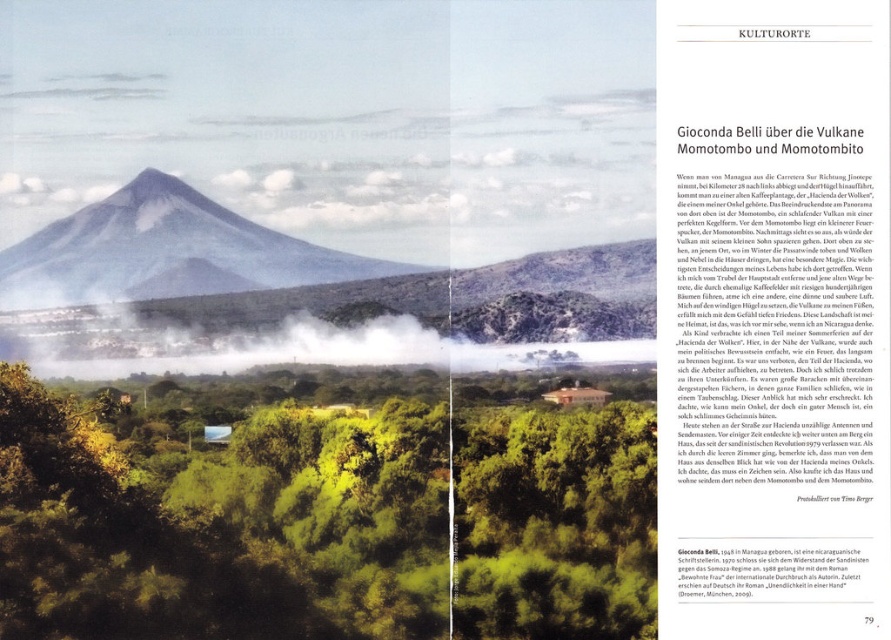
Question: Which object appears farthest from the camera in this image?

Choices:
 (A) black paper at lower center
 (B) green leafy tree at center

Answer: (A)

Question: Is the position of green leafy tree at center more distant than that of black paper at lower center?

Choices:
 (A) yes
 (B) no

Answer: (B)

Question: From the image, what is the correct spatial relationship of green leafy tree at center in relation to black paper at lower center?

Choices:
 (A) below
 (B) above

Answer: (B)

Question: Can you confirm if green leafy tree at center is wider than gray volcanic mountain at center?

Choices:
 (A) no
 (B) yes

Answer: (B)

Question: Considering the real-world distances, which object is farthest from the green leafy tree at center?

Choices:
 (A) gray volcanic mountain at center
 (B) black paper at lower center

Answer: (B)

Question: Considering the real-world distances, which object is closest to the gray volcanic mountain at center?

Choices:
 (A) green leafy tree at center
 (B) black paper at lower center

Answer: (A)